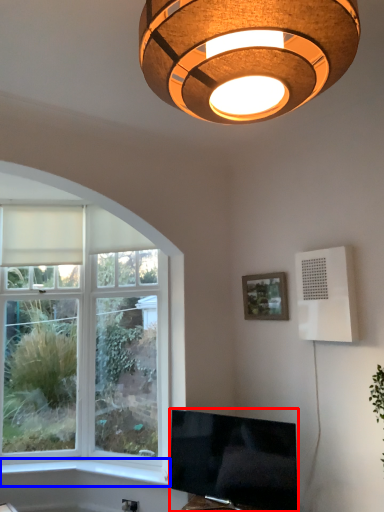
Question: Which point is further to the camera, television (highlighted by a red box) or window sill (highlighted by a blue box)?

Choices:
 (A) television
 (B) window sill

Answer: (B)